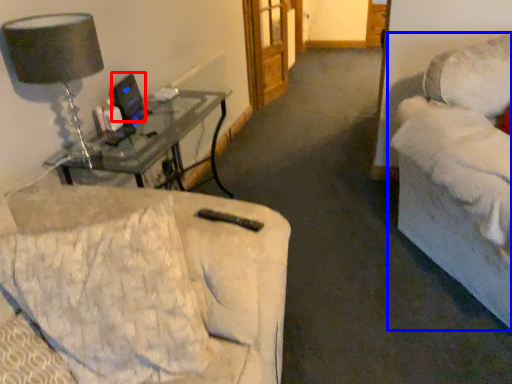
Question: Which point is further to the camera, computer monitor (highlighted by a red box) or studio couch (highlighted by a blue box)?

Choices:
 (A) computer monitor
 (B) studio couch

Answer: (A)